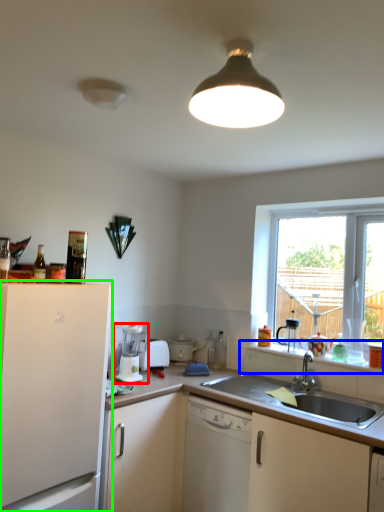
Question: Based on their relative distances, which object is farther from coffee machine (highlighted by a red box)? Choose from window sill (highlighted by a blue box) and cabinetry (highlighted by a green box).

Choices:
 (A) window sill
 (B) cabinetry

Answer: (A)